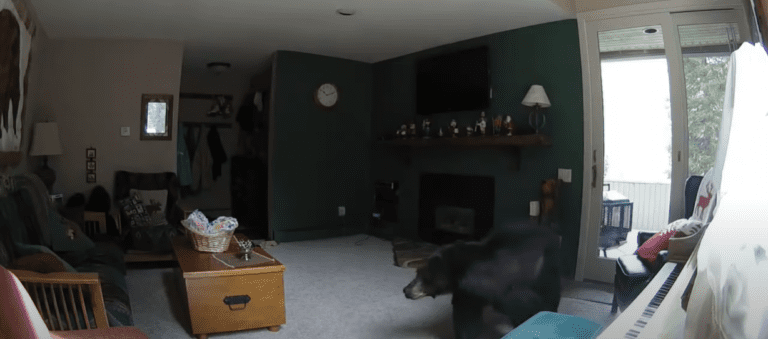
You are a GUI agent. You are given a task and a screenshot of the screen. Output one action in this format:
    pyautogui.click(x=<x>, y=<y>)
    Task: Click on the fireplace
    The width and height of the screenshot is (768, 339).
    Given the screenshot: What is the action you would take?
    pyautogui.click(x=455, y=216)